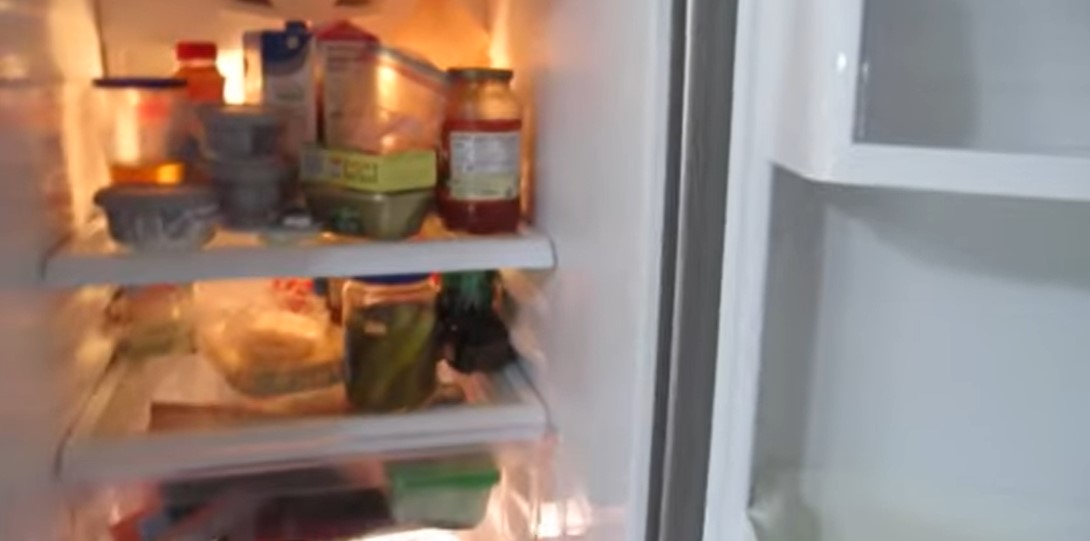
Image resolution: width=1090 pixels, height=541 pixels. What are the coordinates of `fridge shelves` in the screenshot? It's located at (446, 425), (372, 261).